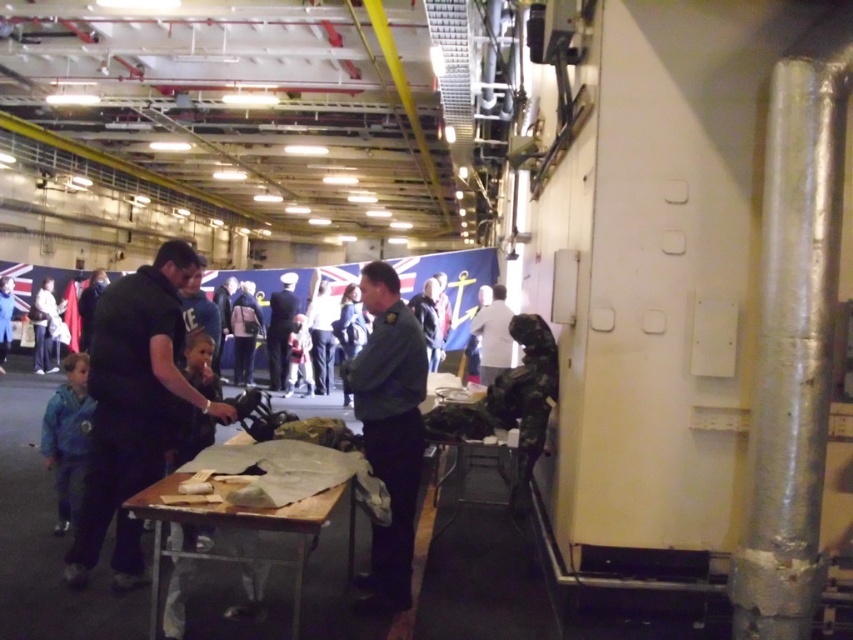
Consider the image. Which is more to the right, silver metallic pipe at right or blue denim jacket at lower left?

Positioned to the right is silver metallic pipe at right.

Does point (834, 192) come closer to viewer compared to point (4, 321)?

Yes, it is in front of point (4, 321).

Is point (773, 576) positioned in front of point (9, 307)?

Yes.

What are the coordinates of `silver metallic pipe at right` in the screenshot? It's located at (792, 348).

Between wooden table at center and dark blue uniform at center, which one appears on the left side from the viewer's perspective?

dark blue uniform at center is more to the left.

Does wooden table at center appear on the right side of dark blue uniform at center?

Correct, you'll find wooden table at center to the right of dark blue uniform at center.

Which is in front, point (164, 480) or point (277, 321)?

Point (164, 480) is more forward.

This screenshot has width=853, height=640. I want to click on wooden table at center, so click(x=231, y=536).

Does point (788, 632) come in front of point (415, 433)?

Yes, point (788, 632) is in front of point (415, 433).

Does point (776, 272) come farther from viewer compared to point (347, 387)?

No, (776, 272) is in front of (347, 387).

Find the location of a particular element. This screenshot has width=853, height=640. silver metallic pipe at right is located at coordinates (792, 348).